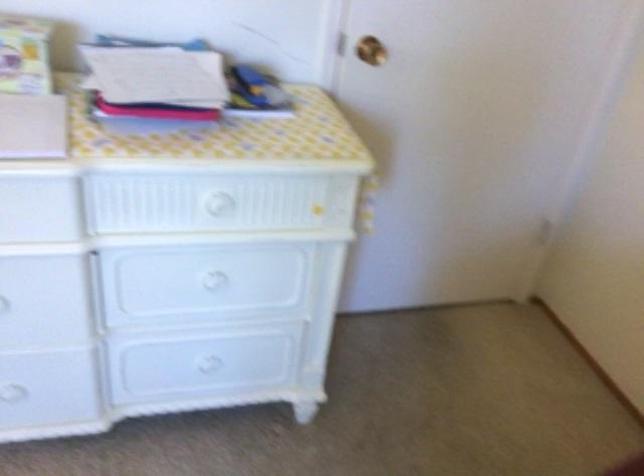
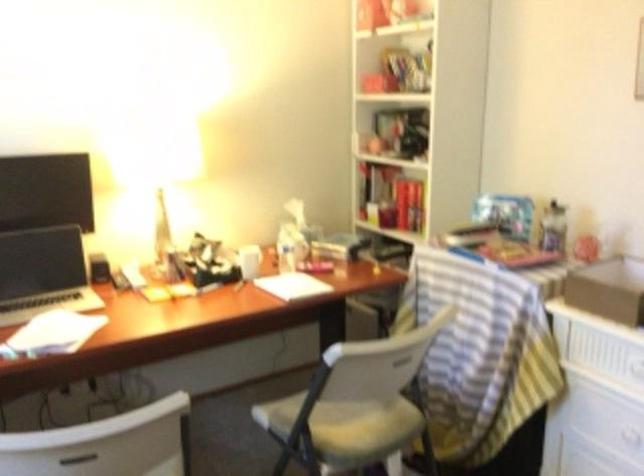
Question: The first image is from the beginning of the video and the second image is from the end. How did the camera likely rotate when shooting the video?

Choices:
 (A) Left
 (B) Right
 (C) Up
 (D) Down

Answer: (A)